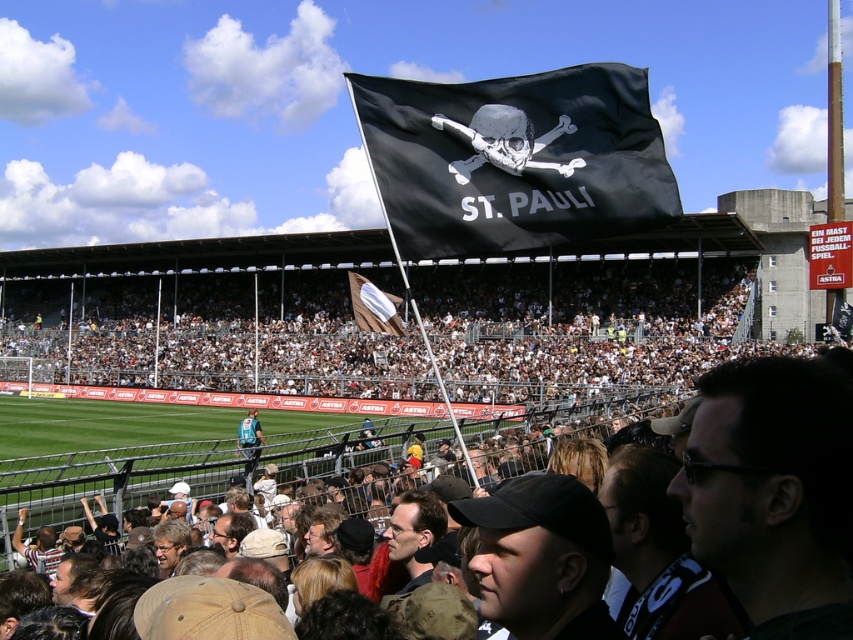
Which is more to the left, black fabric flag at upper center or brown fabric flag at center?

brown fabric flag at center

Who is more forward, (x=625, y=212) or (x=364, y=284)?

Point (x=625, y=212) is in front.

The height and width of the screenshot is (640, 853). Identify the location of black fabric flag at upper center. 514,160.

Is white plastic stadium seats at center thinner than brown fabric flag at center?

Incorrect, white plastic stadium seats at center's width is not less than brown fabric flag at center's.

Is white plastic stadium seats at center positioned in front of brown fabric flag at center?

That is False.

At what (x,y) coordinates should I click in order to perform the action: click on white plastic stadium seats at center. Please return your answer as a coordinate pair (x, y). Image resolution: width=853 pixels, height=640 pixels. Looking at the image, I should click on (213, 337).

Identify the location of white plastic stadium seats at center. The width and height of the screenshot is (853, 640). (213, 337).

Is white plastic stadium seats at center closer to camera compared to black fabric flag at upper center?

No, it is not.

Is white plastic stadium seats at center above black fabric flag at upper center?

Incorrect, white plastic stadium seats at center is not positioned above black fabric flag at upper center.

This screenshot has width=853, height=640. Find the location of `white plastic stadium seats at center`. white plastic stadium seats at center is located at coordinates (213, 337).

Where is `white plastic stadium seats at center`? Image resolution: width=853 pixels, height=640 pixels. white plastic stadium seats at center is located at coordinates (213, 337).